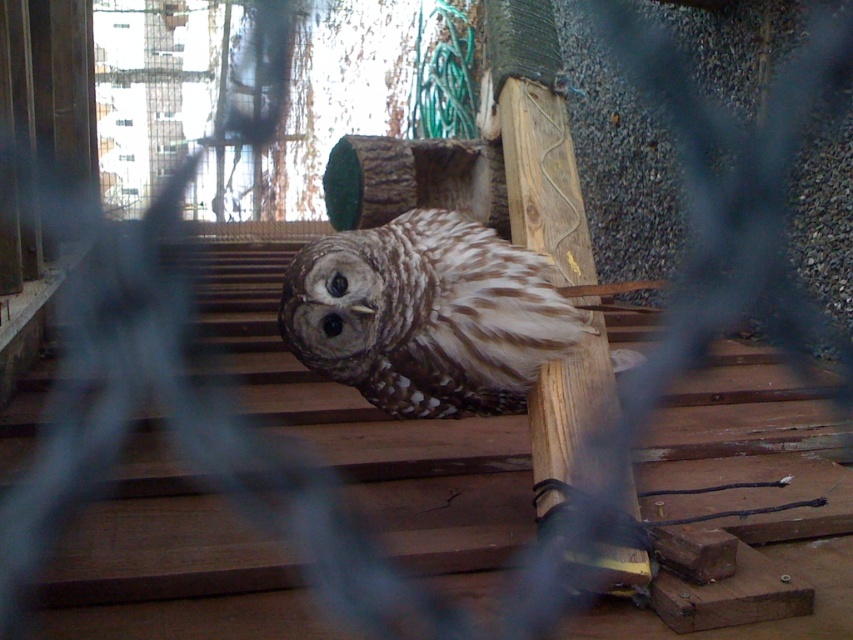
You are a zookeeper observing the barred owl in its enclosure. You need to place a treat on the brown wood stairs at center so the owl can reach it easily. However, you must ensure the treat is not too close to the brown speckled feathers at center. Based on their positions, where should you place the treat?

The brown wood stairs at center are to the left of the brown speckled feathers at center, so placing the treat on the brown wood stairs at center to the left side away from the brown speckled feathers at center would keep it a safe distance.

You are a zookeeper who needs to reach the barred owl resting on the wooden platform. The platform is located near the center of the enclosure. To access it, you must climb a set of stairs. Based on the image, where exactly are the brown wood stairs at center located in terms of coordinates?

The brown wood stairs at center are located at coordinates point (370, 433).